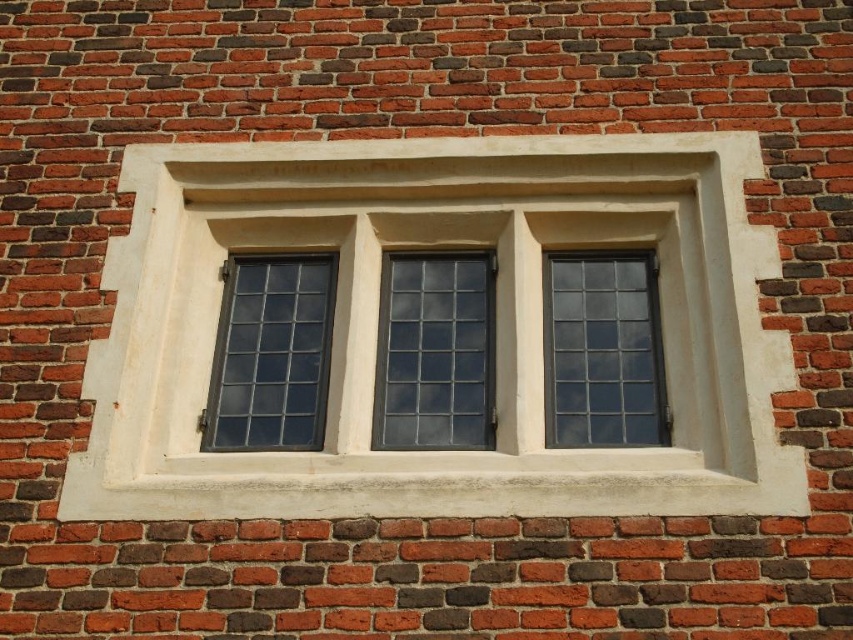
You are an architect designing a new building and want to ensure proper spacing between the white stone window frame at center and the clear glass window at center right. According to the image, what is the minimum distance you should leave between them?

The minimum distance you should leave between the white stone window frame at center and the clear glass window at center right is 62.92 centimeters, as shown in the image.